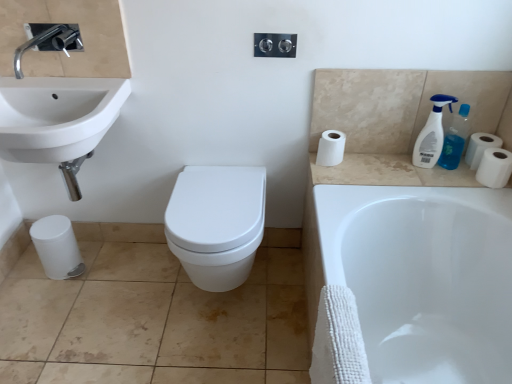
At what (x,y) coordinates should I click in order to perform the action: click on vacant area located to the right-hand side of white matte toilet paper at lower left, which is the fourth toilet paper in top-to-bottom order. Please return your answer as a coordinate pair (x, y). This screenshot has width=512, height=384. Looking at the image, I should click on (106, 269).